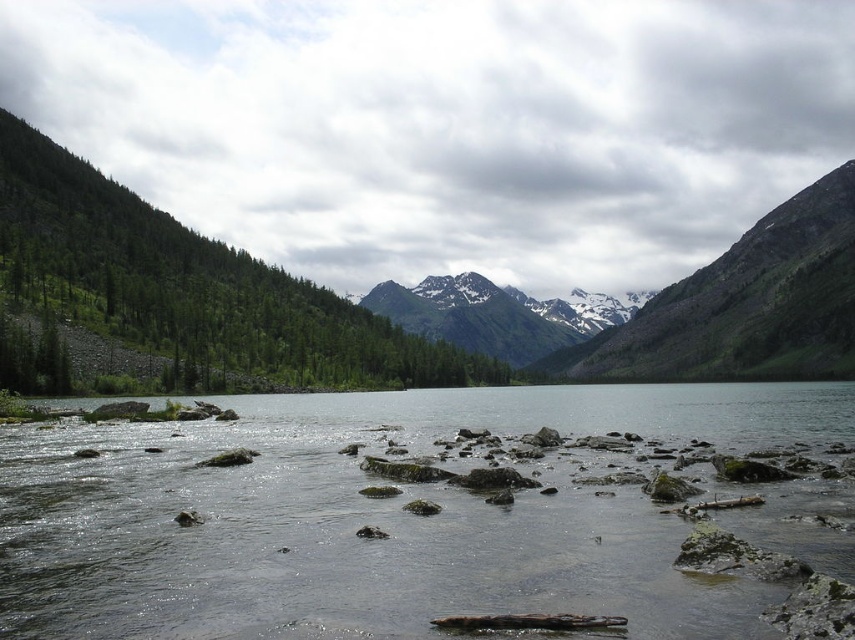
Can you confirm if clear water at center is smaller than snowy granite mountain at center?

Correct, clear water at center occupies less space than snowy granite mountain at center.

In the scene shown: Does clear water at center have a greater width compared to snowy granite mountain at center?

No, clear water at center is not wider than snowy granite mountain at center.

Measure the distance between clear water at center and camera.

They are 128.68 feet apart.

This screenshot has width=855, height=640. In order to click on clear water at center in this screenshot , I will do `click(370, 518)`.

Who is lower down, clear water at center or green matte tree at left?

clear water at center is lower down.

Which is more to the right, clear water at center or green matte tree at left?

Positioned to the right is clear water at center.

You are a GUI agent. You are given a task and a screenshot of the screen. Output one action in this format:
    pyautogui.click(x=<x>, y=<y>)
    Task: Click on the clear water at center
    The width and height of the screenshot is (855, 640).
    Given the screenshot: What is the action you would take?
    pyautogui.click(x=370, y=518)

What do you see at coordinates (190, 288) in the screenshot? I see `green matte tree at left` at bounding box center [190, 288].

Does green matte tree at left have a lesser width compared to snowy granite mountain at center?

Yes, green matte tree at left is thinner than snowy granite mountain at center.

Does point (252, 298) come in front of point (498, 291)?

That is True.

Locate an element on the screen. This screenshot has width=855, height=640. green matte tree at left is located at coordinates (190, 288).